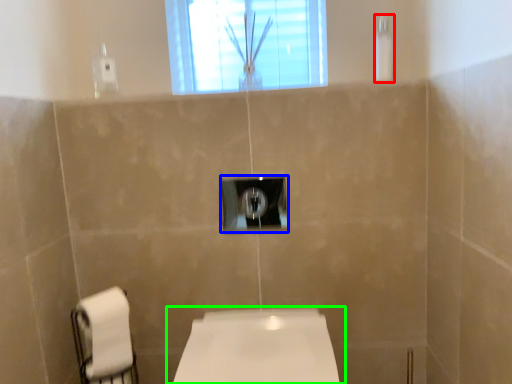
Question: Considering the real-world distances, which object is farthest from shower (highlighted by a red box)? light switch (highlighted by a blue box) or toilet (highlighted by a green box)?

Choices:
 (A) light switch
 (B) toilet

Answer: (B)